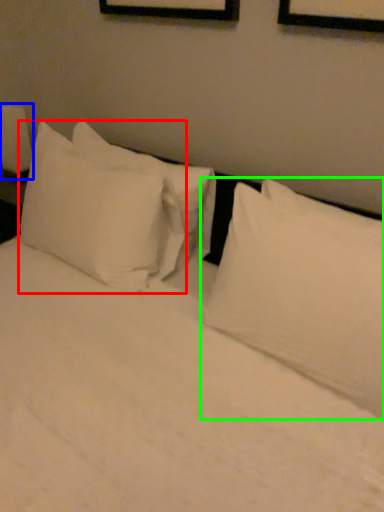
Question: Which object is the closest to the pillow (highlighted by a red box)? Choose among these: bedside lamp (highlighted by a blue box) or pillow (highlighted by a green box).

Choices:
 (A) bedside lamp
 (B) pillow

Answer: (B)